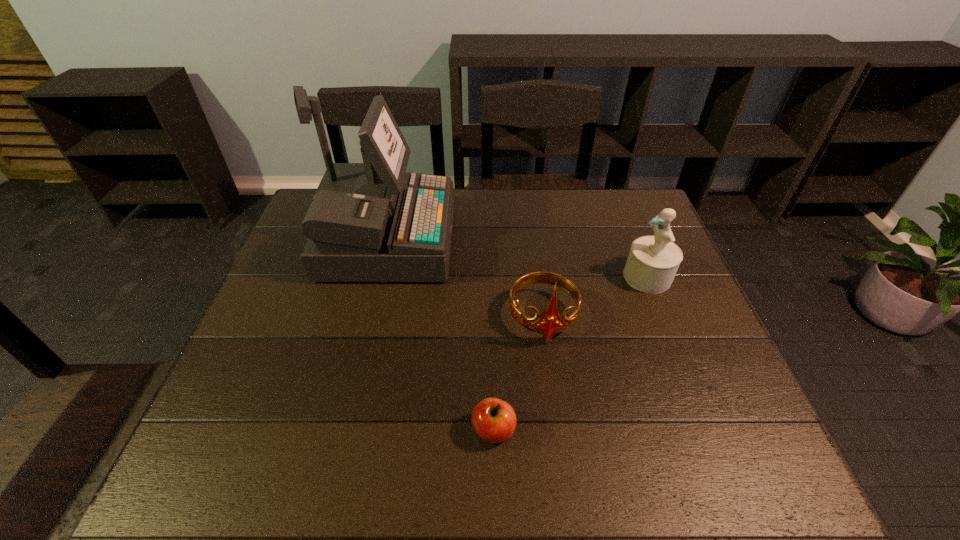
Where is `vacant space located 0.170m on the front-facing side of the tiara`? vacant space located 0.170m on the front-facing side of the tiara is located at coordinates (556, 415).

Locate an element on the screen. The height and width of the screenshot is (540, 960). vacant space situated 0.380m on the back of the apple is located at coordinates (491, 284).

At what (x,y) coordinates should I click in order to perform the action: click on object present at the far edge. Please return your answer as a coordinate pair (x, y). The image size is (960, 540). Looking at the image, I should click on (368, 222).

The image size is (960, 540). In order to click on object that is at the near edge in this screenshot , I will do `click(494, 420)`.

Where is `object present at the left edge`? The image size is (960, 540). object present at the left edge is located at coordinates (368, 222).

I want to click on object that is at the right edge, so click(x=652, y=263).

Locate an element on the screen. Image resolution: width=960 pixels, height=540 pixels. object present at the far left corner is located at coordinates (368, 222).

Where is `vacant space at the far edge of the desktop`? The height and width of the screenshot is (540, 960). vacant space at the far edge of the desktop is located at coordinates (568, 211).

Identify the location of blank space at the near edge of the desktop. This screenshot has height=540, width=960. (403, 451).

You are a GUI agent. You are given a task and a screenshot of the screen. Output one action in this format:
    pyautogui.click(x=<x>, y=<y>)
    Task: Click on the vacant space at the left edge of the desktop
    The width and height of the screenshot is (960, 540).
    Given the screenshot: What is the action you would take?
    pyautogui.click(x=286, y=332)